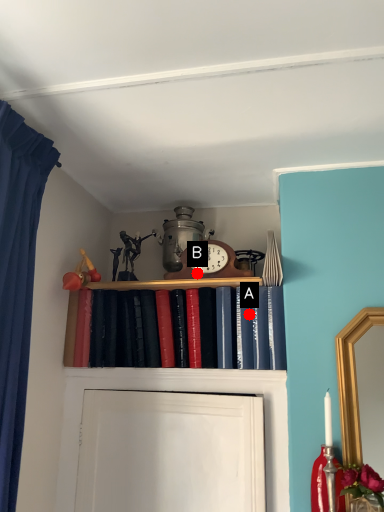
Question: Two points are circled on the image, labeled by A and B beside each circle. Which point is further to the camera?

Choices:
 (A) A is further
 (B) B is further

Answer: (B)